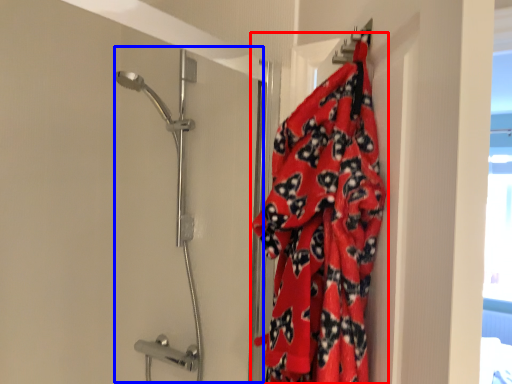
Question: Which object appears closest to the camera in this image, blanket (highlighted by a red box) or shower door (highlighted by a blue box)?

Choices:
 (A) blanket
 (B) shower door

Answer: (A)